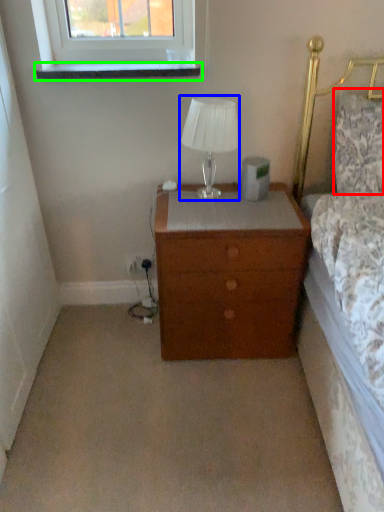
Question: Which is nearer to the pillow (highlighted by a red box)? table lamp (highlighted by a blue box) or window sill (highlighted by a green box).

Choices:
 (A) table lamp
 (B) window sill

Answer: (A)